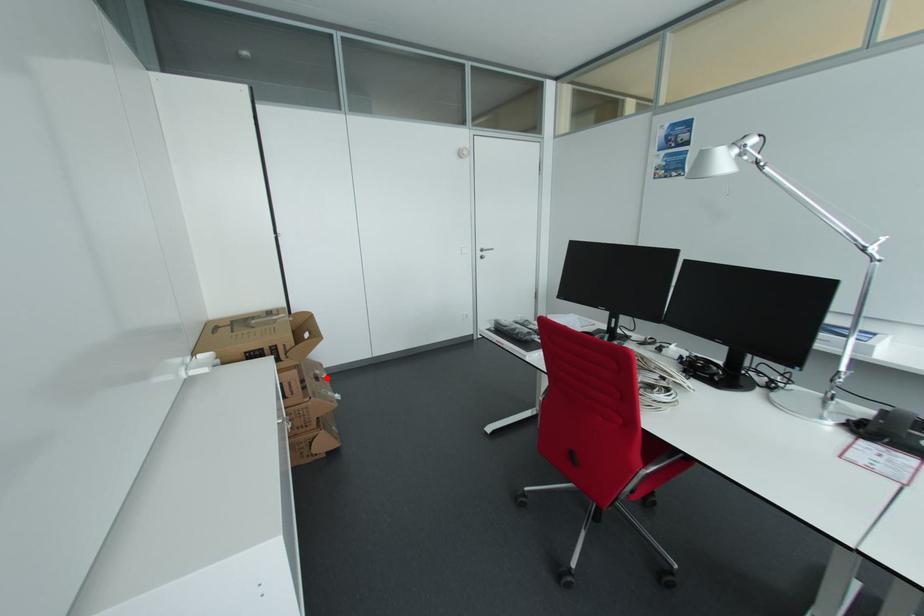
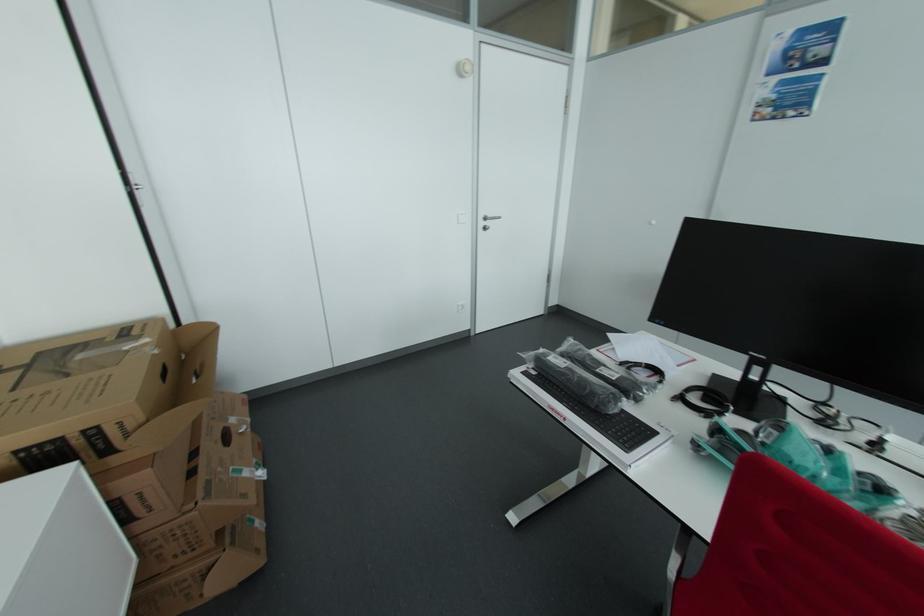
In the second image, find the point that corresponds to the highlighted location in the first image.

(245, 432)